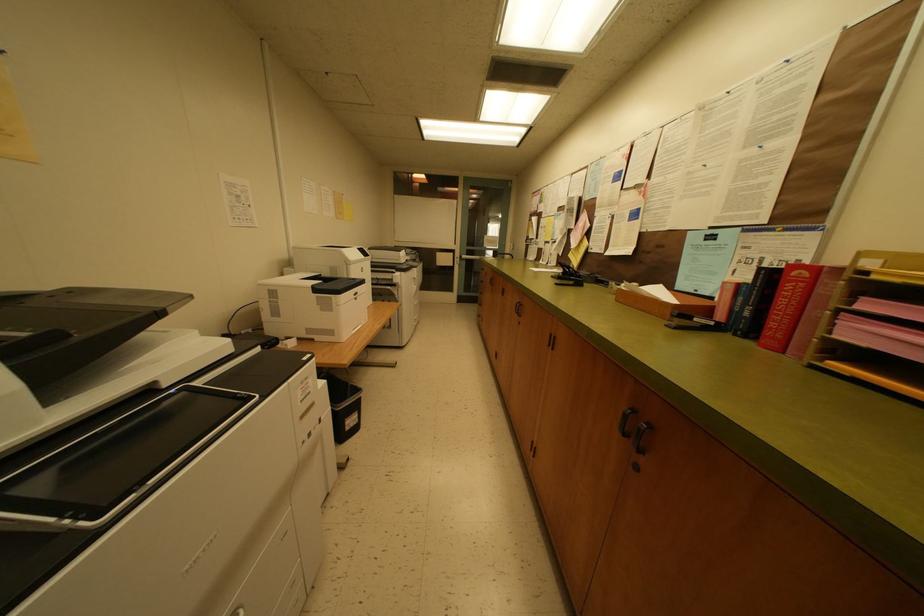
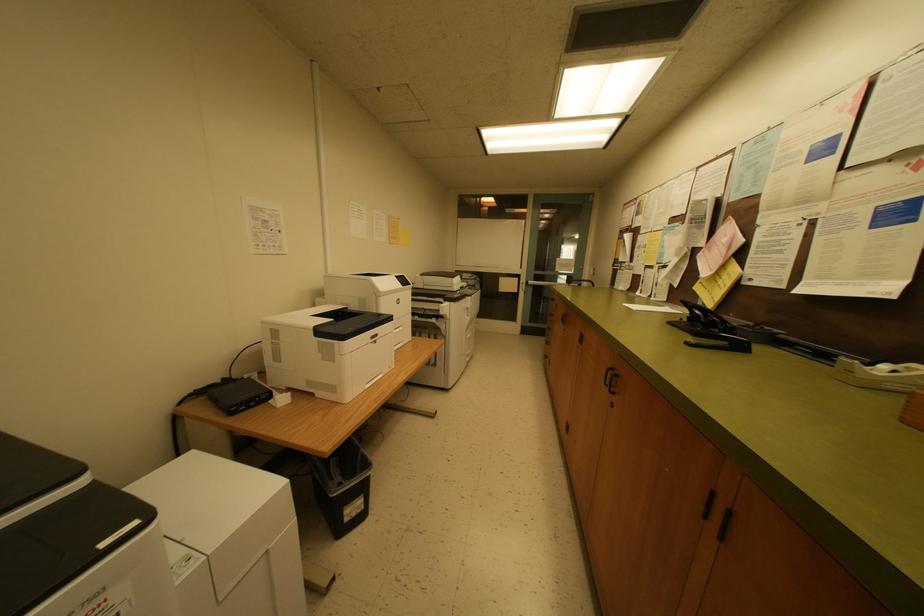
Question: The first image is from the beginning of the video and the second image is from the end. How did the camera likely rotate when shooting the video?

Choices:
 (A) Left
 (B) Right
 (C) Up
 (D) Down

Answer: (A)